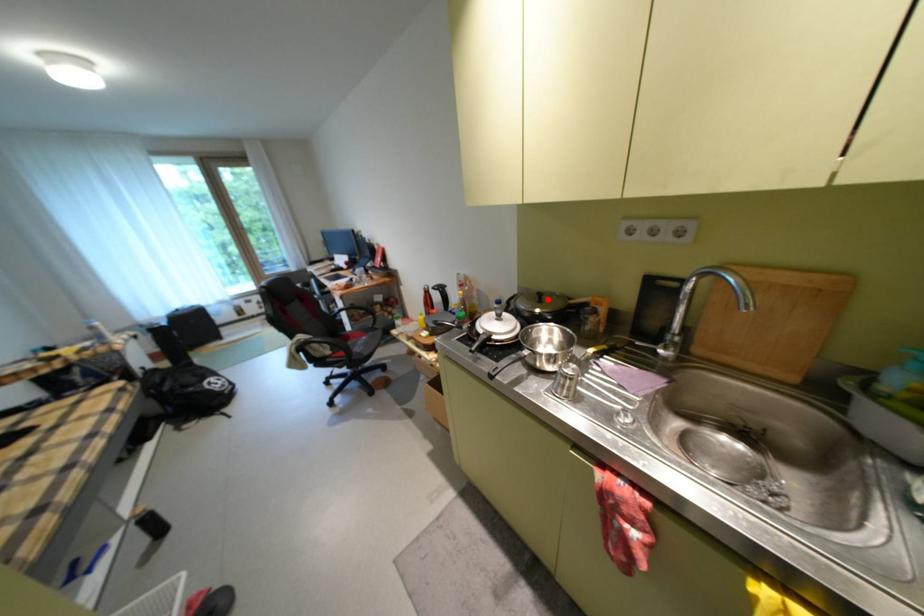
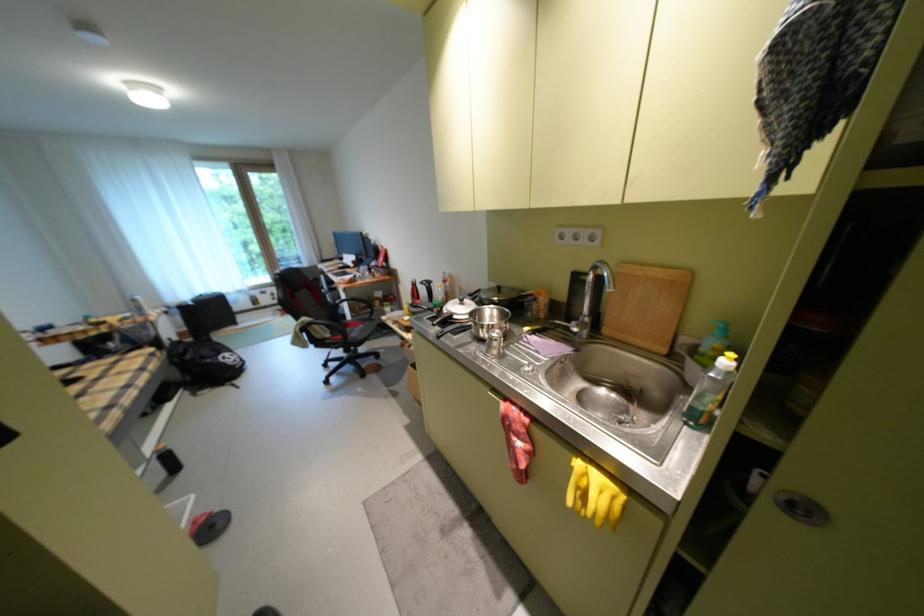
The point at the highlighted location is marked in the first image. Where is the corresponding point in the second image?

(507, 292)